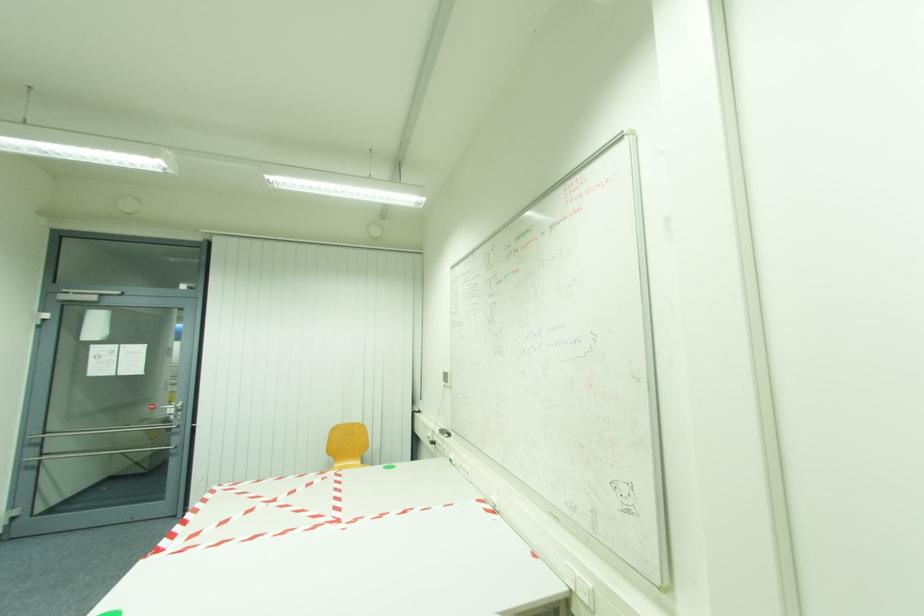
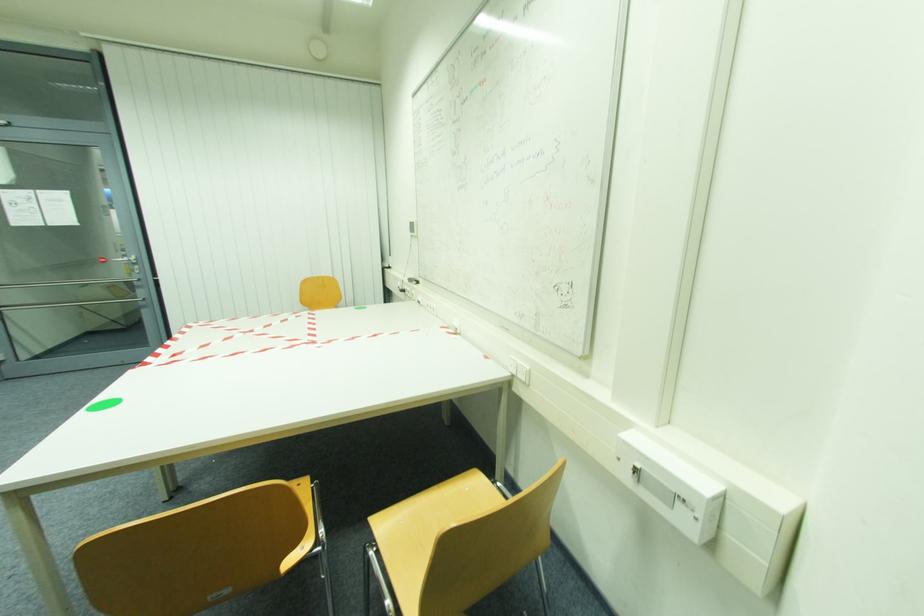
What movement of the cameraman would produce the second image?

The cameraman moved toward right, backward.